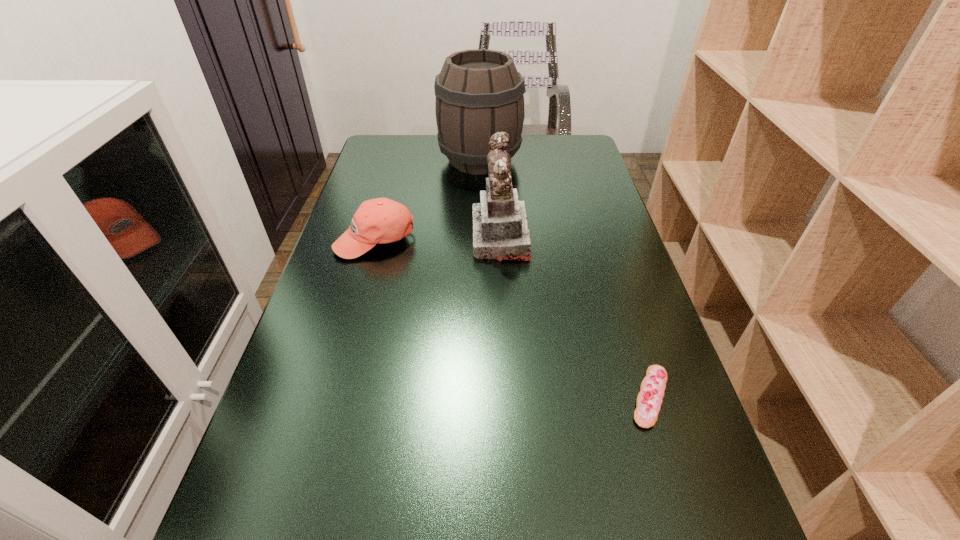
Image resolution: width=960 pixels, height=540 pixels. In order to click on vacant space that is in between the baseball cap and the shortest object in this screenshot , I will do `click(513, 318)`.

Where is `free point between the farthest object and the nearest object`? This screenshot has width=960, height=540. free point between the farthest object and the nearest object is located at coordinates (564, 279).

Locate an element on the screen. The width and height of the screenshot is (960, 540). free space between the nearest object and the leftmost object is located at coordinates (513, 318).

The image size is (960, 540). I want to click on vacant space that is in between the leftmost object and the figurine, so click(x=438, y=238).

This screenshot has width=960, height=540. What are the coordinates of `empty space that is in between the shortest object and the wine bucket` in the screenshot? It's located at click(x=564, y=279).

Find the location of a particular element. This screenshot has width=960, height=540. object that ranks as the second closest to the leftmost object is located at coordinates (479, 92).

At what (x,y) coordinates should I click in order to perform the action: click on object that stands as the third closest to the wine bucket. Please return your answer as a coordinate pair (x, y). This screenshot has width=960, height=540. Looking at the image, I should click on (649, 400).

The height and width of the screenshot is (540, 960). Identify the location of free spot that satisfies the following two spatial constraints: 1. on the front-facing side of the figurine; 2. on the back side of the eclair. (510, 397).

Find the location of a particular element. The width and height of the screenshot is (960, 540). free space that satisfies the following two spatial constraints: 1. on the back side of the wine bucket; 2. on the left side of the baseball cap is located at coordinates (397, 160).